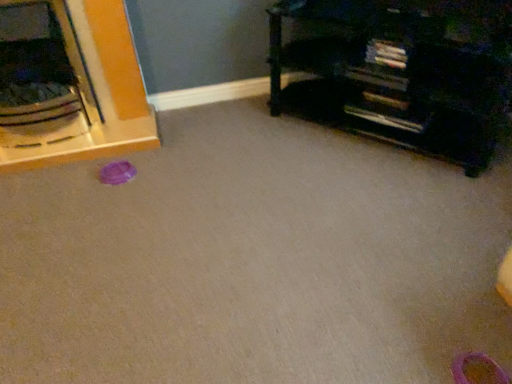
At what (x,y) coordinates should I click in order to perform the action: click on vacant area that lies between brushed metal bowl at left, the second furniture viewed from the right, and pink rubber shoe at lower right. Please return your answer as a coordinate pair (x, y). Looking at the image, I should click on (216, 227).